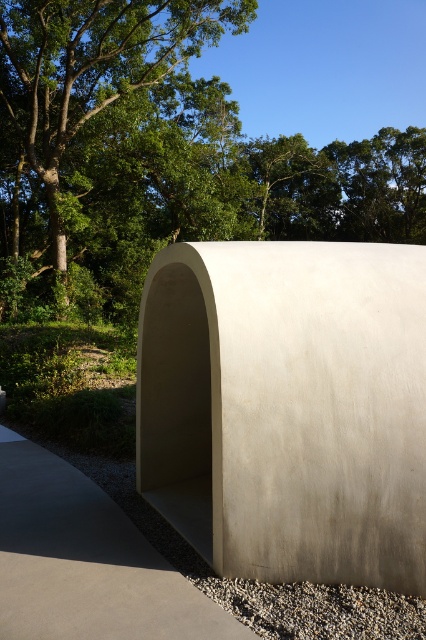
You are standing in front of the curved concrete structure and want to place a small decorative rock at each of the two points marked in the image. Which point should you place the rock closer to the camera? Please choose between point (158, 502) and point (83, 312).

Point (158, 502) is closer to the camera than point (83, 312), so you should place the decorative rock at point (158, 502) to have it closer to the camera.

You are standing in front of the curved concrete structure and want to walk towards the point that is closer to you. Which point should you head towards, point (x=371, y=500) or point (x=344, y=620)?

You should head towards point (x=344, y=620) because point (x=371, y=500) is further away from you compared to point (x=344, y=620) according to the description.

What are the coordinates of the white concrete shelter at center?

The white concrete shelter at center is located at coordinates point (287, 406).